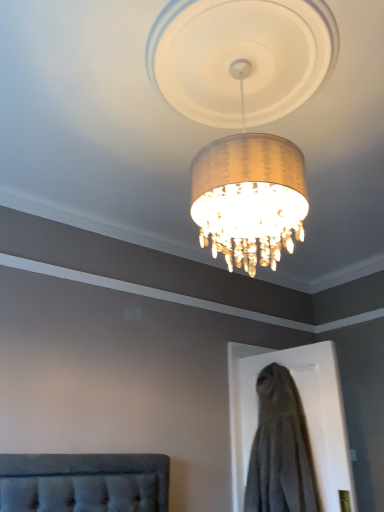
Question: Considering the relative positions of gold textured lampshade at center and gray fabric dress at lower right in the image provided, is gold textured lampshade at center behind gray fabric dress at lower right?

Choices:
 (A) yes
 (B) no

Answer: (B)

Question: Can gray fabric dress at lower right be found inside gold textured lampshade at center?

Choices:
 (A) yes
 (B) no

Answer: (B)

Question: Can you confirm if gold textured lampshade at center is positioned to the left of gray fabric dress at lower right?

Choices:
 (A) no
 (B) yes

Answer: (B)

Question: From the image's perspective, is gold textured lampshade at center over gray fabric dress at lower right?

Choices:
 (A) yes
 (B) no

Answer: (A)

Question: Is gold textured lampshade at center wider than gray fabric dress at lower right?

Choices:
 (A) yes
 (B) no

Answer: (A)

Question: Is gold textured lampshade at center closer to the viewer compared to gray fabric dress at lower right?

Choices:
 (A) no
 (B) yes

Answer: (B)

Question: From a real-world perspective, is gray fabric dress at lower right located beneath gold textured lampshade at center?

Choices:
 (A) no
 (B) yes

Answer: (B)

Question: Is gold textured lampshade at center at the back of gray fabric dress at lower right?

Choices:
 (A) yes
 (B) no

Answer: (B)

Question: Is gray fabric dress at lower right next to gold textured lampshade at center and touching it?

Choices:
 (A) no
 (B) yes

Answer: (A)

Question: Is gray fabric dress at lower right closer to the viewer compared to gold textured lampshade at center?

Choices:
 (A) no
 (B) yes

Answer: (A)

Question: Is gray fabric dress at lower right outside gold textured lampshade at center?

Choices:
 (A) yes
 (B) no

Answer: (A)

Question: Considering the relative sizes of gray fabric dress at lower right and gold textured lampshade at center in the image provided, is gray fabric dress at lower right bigger than gold textured lampshade at center?

Choices:
 (A) yes
 (B) no

Answer: (B)

Question: In terms of height, does gray fabric dress at lower right look taller or shorter compared to gold textured lampshade at center?

Choices:
 (A) short
 (B) tall

Answer: (B)